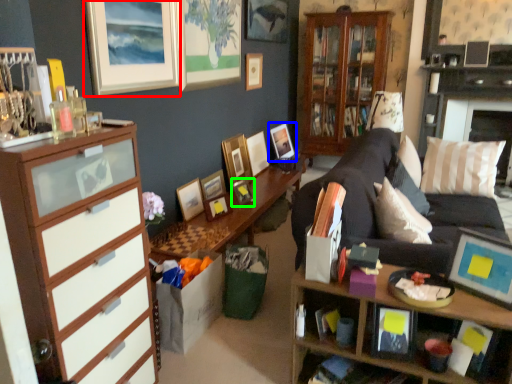
Question: Considering the real-world distances, which object is farthest from picture frame (highlighted by a red box)? picture frame (highlighted by a blue box) or picture frame (highlighted by a green box)?

Choices:
 (A) picture frame
 (B) picture frame

Answer: (A)